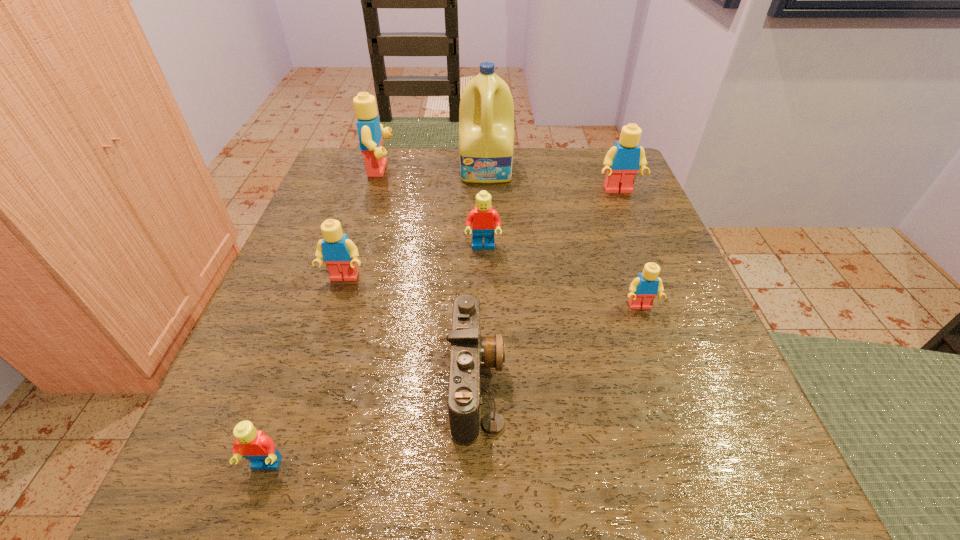
Locate an element on the screen. This screenshot has height=540, width=960. detergent is located at coordinates (486, 114).

The height and width of the screenshot is (540, 960). I want to click on the second tallest object, so click(x=370, y=131).

Identify the location of the biggest yellow Lego. (370, 131).

The height and width of the screenshot is (540, 960). What are the coordinates of `the second tallest Lego` in the screenshot? It's located at (622, 161).

Find the location of a particular element. Image resolution: width=960 pixels, height=540 pixels. the sixth shortest object is located at coordinates [622, 161].

The width and height of the screenshot is (960, 540). I want to click on the fourth nearest object, so click(x=339, y=253).

I want to click on the third biggest yellow Lego, so click(x=339, y=253).

Find the location of a particular element. Image resolution: width=960 pixels, height=540 pixels. the right red Lego is located at coordinates (483, 218).

At what (x,y) coordinates should I click in order to perform the action: click on the third farthest Lego. Please return your answer as a coordinate pair (x, y). The width and height of the screenshot is (960, 540). Looking at the image, I should click on (483, 218).

The image size is (960, 540). Identify the location of the second nearest object. (469, 352).